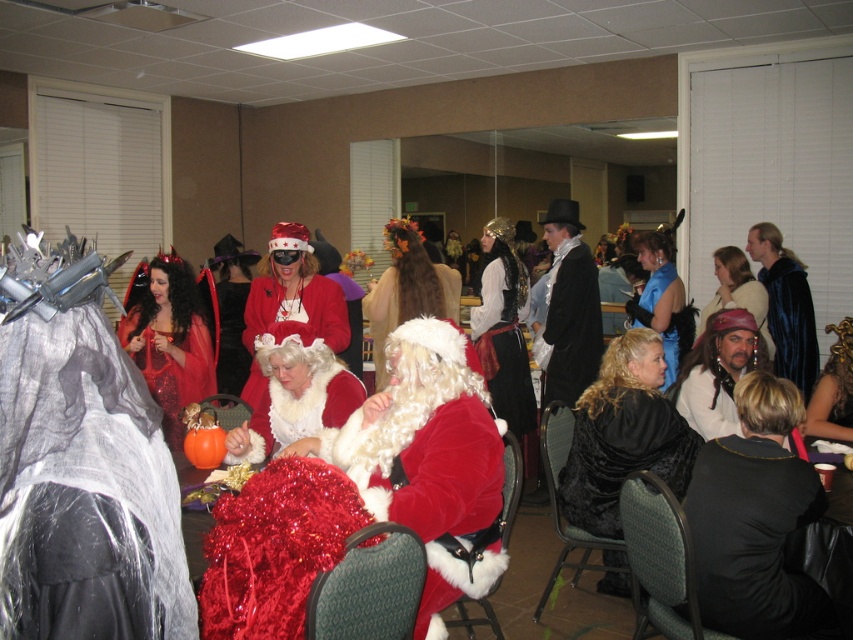
You are standing at the entrance of the room and notice two items in the center area. One is the black velvet coat at center and the other is the leather vest at center. Which item would appear larger to you?

The black velvet coat at center appears larger because it is closer to the viewer than the leather vest at center.

You are standing at the entrance of the room and see two points marked in the image. The first point is at coordinates point (583,387) and the second point is at point (763,332). Which point is closer to you?

Point (583,387) is in front of point (763,332), so it is closer to you.